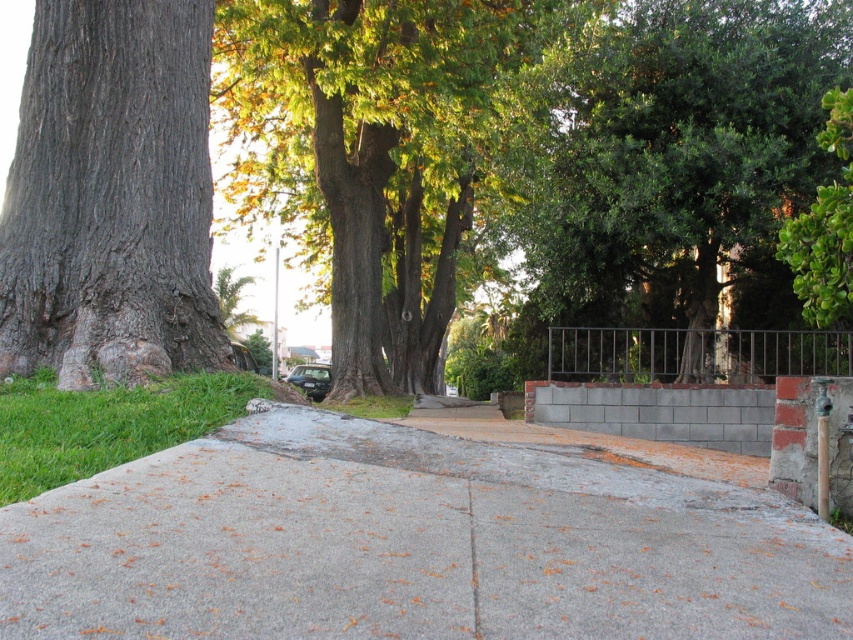
You are standing on the concrete pathway and want to walk towards the green leafy tree at right and the brown rough bark tree at left. Which tree will appear closer to you as you walk along the path?

The green leafy tree at right will appear closer to you because it is positioned closer to the viewer than the brown rough bark tree at left.

You are a gardener trying to determine the best spot to plant a new shrub. The green leafy tree at right and the gray concrete curb at center are both in your view. Which object is positioned higher in the image?

The green leafy tree at right is located above the gray concrete curb at center, so it is positioned higher in the image.